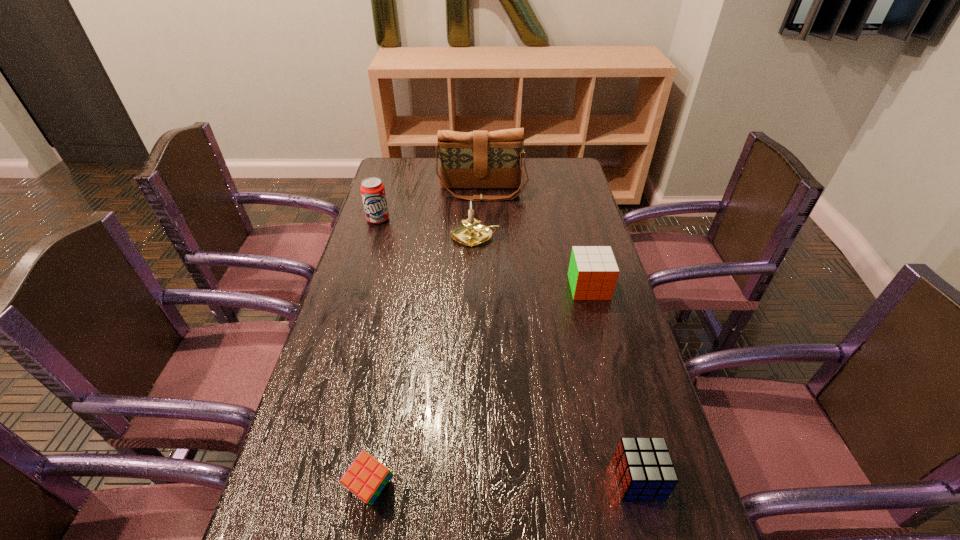
Where is `blank space located 0.150m on the handle side of the fourth nearest object`? Image resolution: width=960 pixels, height=540 pixels. blank space located 0.150m on the handle side of the fourth nearest object is located at coordinates (543, 237).

This screenshot has height=540, width=960. I want to click on free location located 0.190m on the left of the farthest cube, so click(x=507, y=287).

Identify the location of vacant space situated on the back of the leftmost cube. (390, 381).

I want to click on object that is at the far edge, so click(x=479, y=159).

The image size is (960, 540). I want to click on soda can that is at the left edge, so click(x=372, y=189).

This screenshot has width=960, height=540. Identify the location of cube present at the left edge. (366, 477).

In the image, there is a desktop. In order to click on free space at the left edge in this screenshot , I will do `click(321, 373)`.

Where is `vacant space at the right edge`? vacant space at the right edge is located at coordinates [x=556, y=233].

This screenshot has height=540, width=960. Identify the location of free space at the far left corner. (408, 185).

Identify the location of free space at the far right corner. This screenshot has height=540, width=960. (571, 159).